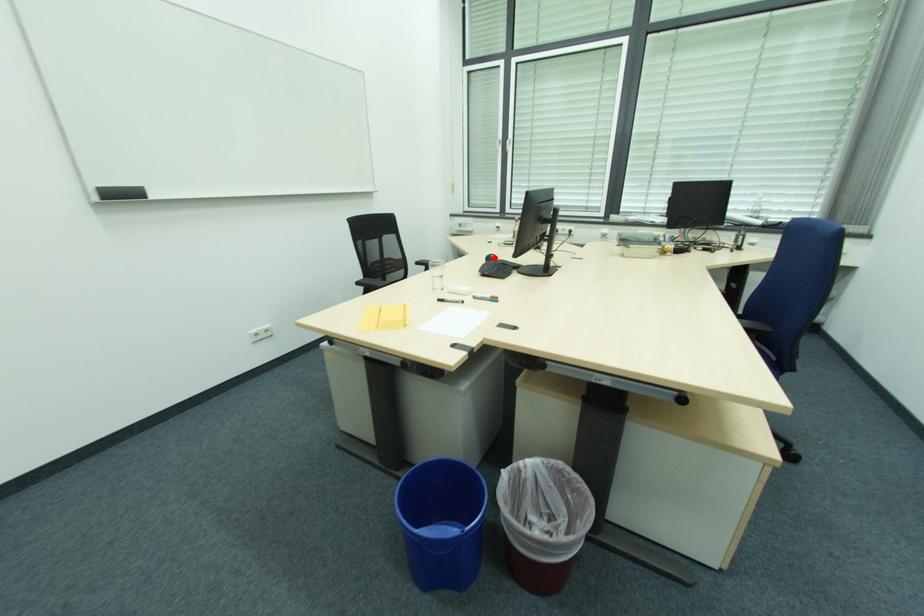
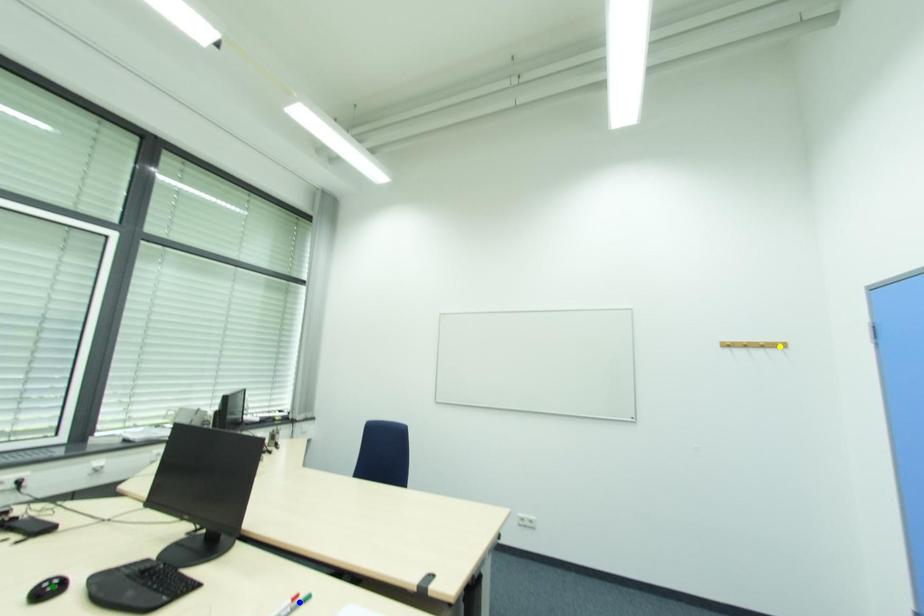
Question: I am providing you with two images of the same scene from different viewpoints. A red point is marked on the first image. You are given multiple points on the second image. Which point in image 2 represents the same 3d spot as the red point in image 1?

Choices:
 (A) yellow point
 (B) blue point
 (C) green point

Answer: (C)